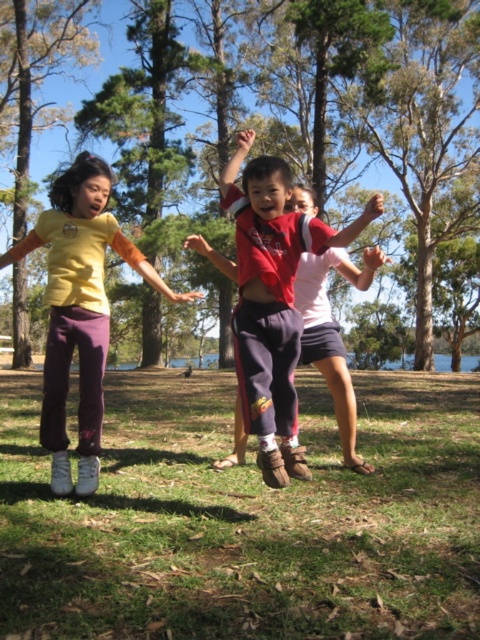
Question: Is reddish-brown cotton shorts at center positioned at the back of matte yellow shirt at center?

Choices:
 (A) yes
 (B) no

Answer: (B)

Question: Which point is closer to the camera taking this photo?

Choices:
 (A) (68, 387)
 (B) (403, 520)
 (C) (259, 339)

Answer: (C)

Question: Which object is closer to the camera taking this photo?

Choices:
 (A) reddish-brown cotton shorts at center
 (B) matte yellow shirt at center

Answer: (A)

Question: Is reddish-brown cotton shorts at center smaller than matte yellow shirt at center?

Choices:
 (A) yes
 (B) no

Answer: (B)

Question: Can you confirm if green grass at lower center is bigger than matte yellow shirt at center?

Choices:
 (A) yes
 (B) no

Answer: (A)

Question: Which object is the closest to the green grass at lower center?

Choices:
 (A) reddish-brown cotton shorts at center
 (B) matte yellow shirt at center

Answer: (A)